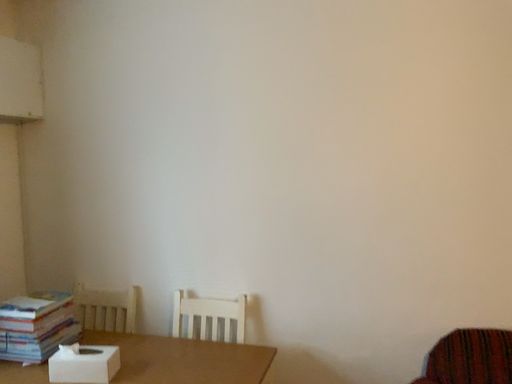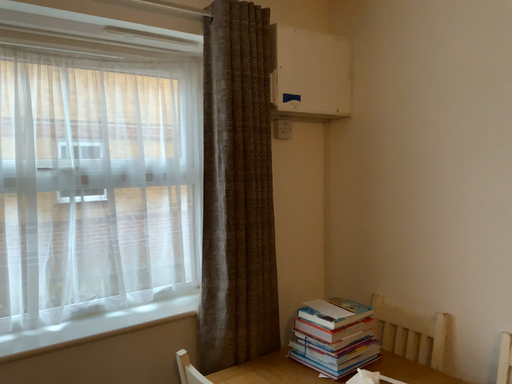
Question: Which way did the camera rotate in the video?

Choices:
 (A) rotated right
 (B) rotated left

Answer: (B)